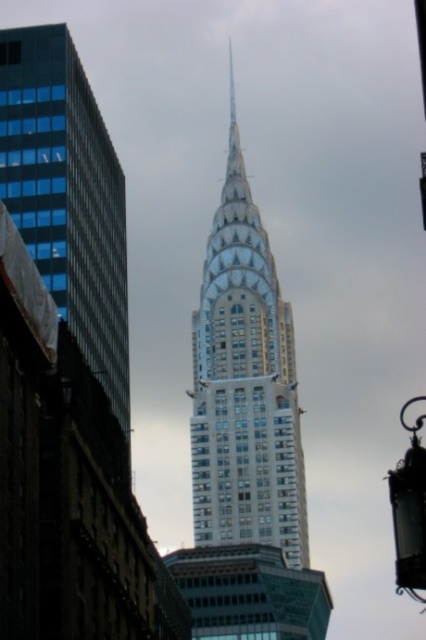
Is glassy steel skyscraper at center below glassy blue skyscraper at left?

Actually, glassy steel skyscraper at center is above glassy blue skyscraper at left.

Can you confirm if glassy steel skyscraper at center is smaller than glassy blue skyscraper at left?

Actually, glassy steel skyscraper at center might be larger than glassy blue skyscraper at left.

What do you see at coordinates (244, 384) in the screenshot? I see `glassy steel skyscraper at center` at bounding box center [244, 384].

This screenshot has height=640, width=426. Identify the location of glassy steel skyscraper at center. (244, 384).